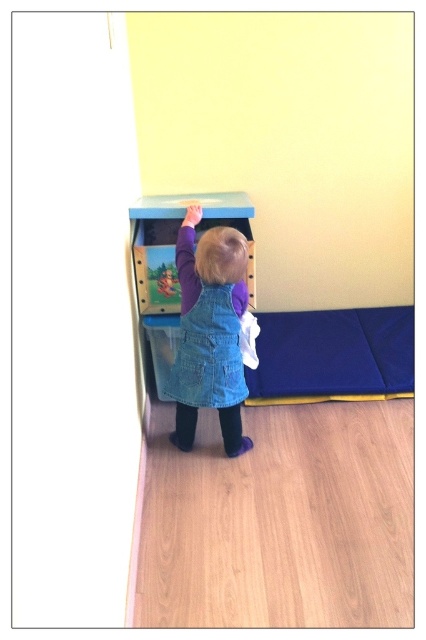
Based on the photo, which of these two, denim dress at center or denim overalls at center, stands taller?

Standing taller between the two is denim dress at center.

Identify the location of denim dress at center. (210, 332).